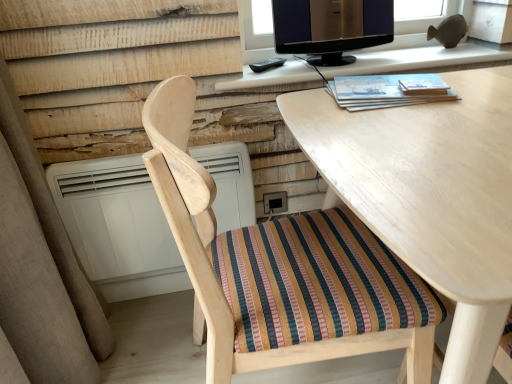
Question: In the image, is black glossy monitor at upper center on the left side or the right side of wooden chair with striped cushion at center?

Choices:
 (A) left
 (B) right

Answer: (B)

Question: Considering the positions of black glossy monitor at upper center and wooden chair with striped cushion at center in the image, is black glossy monitor at upper center bigger or smaller than wooden chair with striped cushion at center?

Choices:
 (A) big
 (B) small

Answer: (B)

Question: Considering the real-world distances, which object is closest to the black glossy monitor at upper center?

Choices:
 (A) matte black monitor at upper center
 (B) white plastic air conditioner at lower left
 (C) wooden chair with striped cushion at center
 (D) light wood desk at center

Answer: (A)

Question: Based on their relative distances, which object is farther from the light wood desk at center?

Choices:
 (A) matte black monitor at upper center
 (B) white plastic air conditioner at lower left
 (C) wooden chair with striped cushion at center
 (D) black glossy monitor at upper center

Answer: (B)